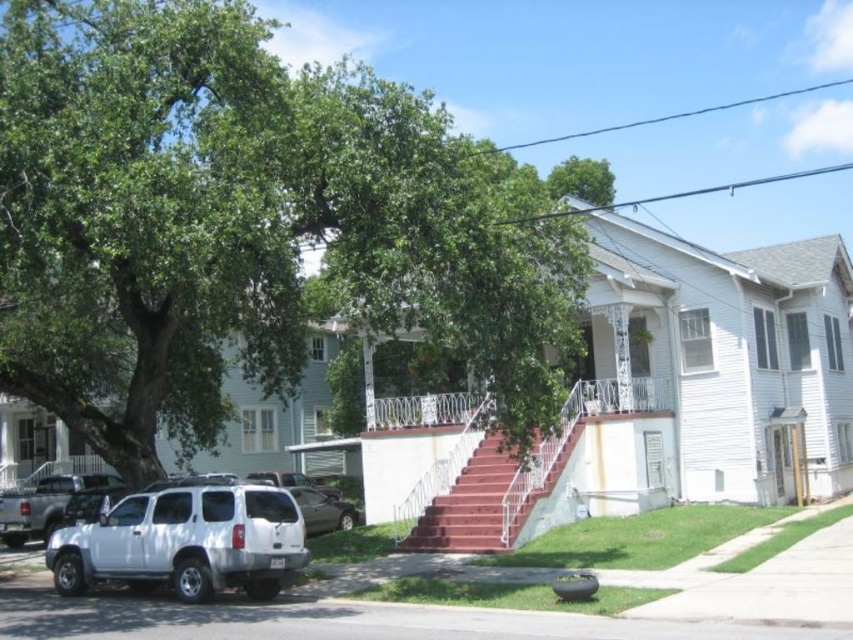
Question: Is green leafy tree at upper left thinner than smooth red stairs at center?

Choices:
 (A) no
 (B) yes

Answer: (A)

Question: Which of the following is the closest to the observer?

Choices:
 (A) (318, 499)
 (B) (416, 540)

Answer: (B)

Question: Does green leafy tree at upper left lie in front of metallic gray sedan at lower center?

Choices:
 (A) yes
 (B) no

Answer: (A)

Question: Is smooth red stairs at center to the left of metallic gray sedan at lower center from the viewer's perspective?

Choices:
 (A) yes
 (B) no

Answer: (B)

Question: Which object is farther from the camera taking this photo?

Choices:
 (A) green leafy tree at upper left
 (B) metallic gray sedan at lower center

Answer: (B)

Question: Which point is closer to the camera?

Choices:
 (A) metallic gray sedan at lower center
 (B) smooth red stairs at center
 (C) white matte suv at lower left

Answer: (C)